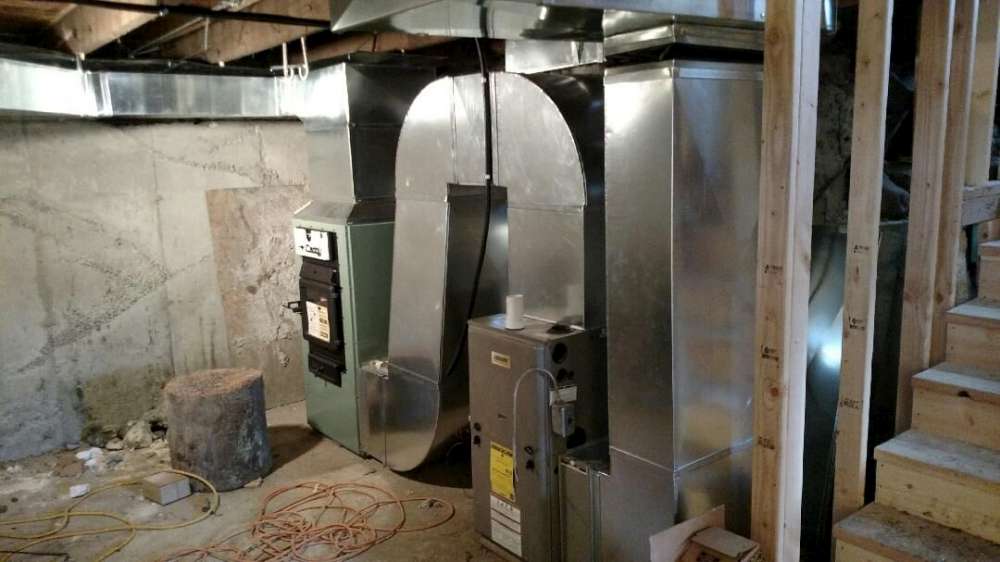
The width and height of the screenshot is (1000, 562). I want to click on wood beams, so click(x=773, y=337), click(x=861, y=255), click(x=930, y=205), click(x=961, y=158).